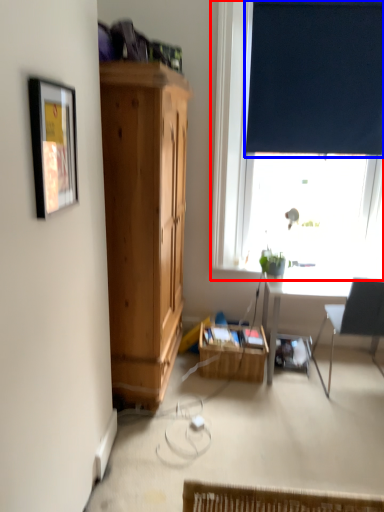
Question: Which object appears farthest to the camera in this image, window (highlighted by a red box) or curtain (highlighted by a blue box)?

Choices:
 (A) window
 (B) curtain

Answer: (B)